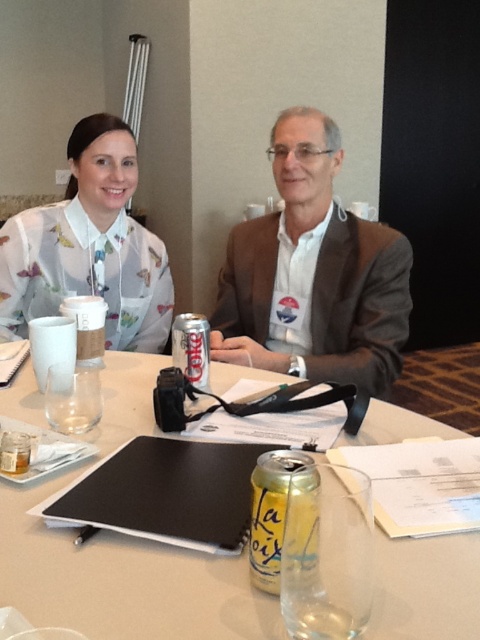
Does matte white blouse at upper left have a greater width compared to matte brown blazer at center?

Correct, the width of matte white blouse at upper left exceeds that of matte brown blazer at center.

Is matte white blouse at upper left to the right of matte brown blazer at center from the viewer's perspective?

Incorrect, matte white blouse at upper left is not on the right side of matte brown blazer at center.

Is point (267, 257) closer to camera compared to point (373, 285)?

No, it is behind (373, 285).

This screenshot has height=640, width=480. I want to click on matte white blouse at upper left, so click(x=313, y=273).

Which is more to the left, translucent floral blouse at upper left or yellow aluminum can at center?

Positioned to the left is translucent floral blouse at upper left.

Between translucent floral blouse at upper left and yellow aluminum can at center, which one has more height?

translucent floral blouse at upper left is taller.

In the scene shown: Who is more distant from viewer, [94,196] or [289,467]?

The point [94,196] is more distant.

Where is `translucent floral blouse at upper left`? translucent floral blouse at upper left is located at coordinates (91, 244).

Between matte brown blazer at center and translucent floral blouse at upper left, which one appears on the left side from the viewer's perspective?

Positioned to the left is translucent floral blouse at upper left.

Which of these two, matte brown blazer at center or translucent floral blouse at upper left, stands shorter?

translucent floral blouse at upper left

At what (x,y) coordinates should I click in order to perform the action: click on matte brown blazer at center. Please return your answer as a coordinate pair (x, y). Looking at the image, I should click on (312, 273).

The image size is (480, 640). I want to click on matte brown blazer at center, so click(x=312, y=273).